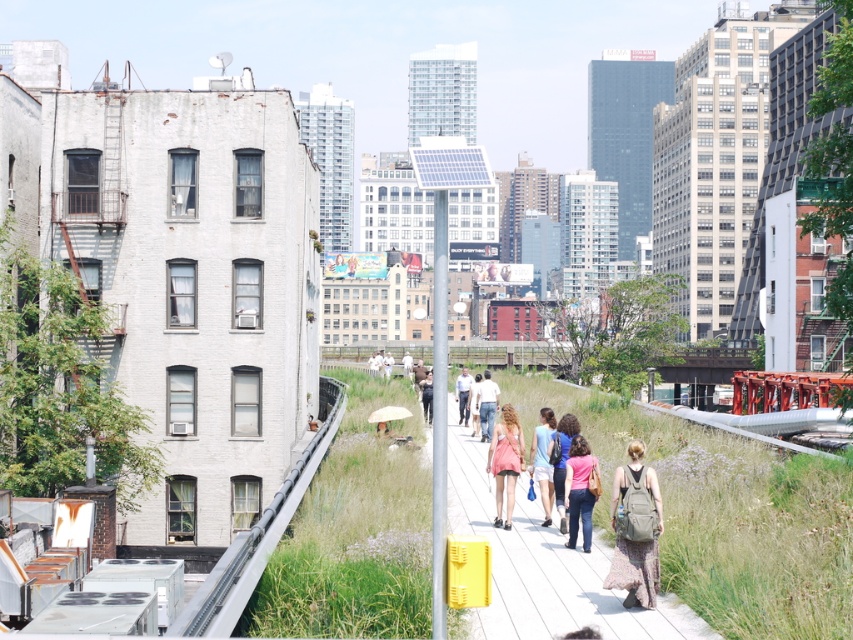
What do you see at coordinates (258, 536) in the screenshot? I see `metallic gray train track at left` at bounding box center [258, 536].

Does metallic gray train track at left appear on the right side of matte blue shirt at center?

Incorrect, metallic gray train track at left is not on the right side of matte blue shirt at center.

Locate an element on the screen. The height and width of the screenshot is (640, 853). metallic gray train track at left is located at coordinates (258, 536).

Who is positioned more to the right, matte blue shirt at center or light blue shirt at center?

Positioned to the right is matte blue shirt at center.

Does matte blue shirt at center have a lesser height compared to light blue shirt at center?

No, matte blue shirt at center is not shorter than light blue shirt at center.

Describe the element at coordinates (561, 460) in the screenshot. I see `matte blue shirt at center` at that location.

Identify the location of matte blue shirt at center. The height and width of the screenshot is (640, 853). (561, 460).

Based on the photo, is pink fabric dress at center closer to camera compared to light brown leather jacket at center?

Yes, it is in front of light brown leather jacket at center.

Can you confirm if pink fabric dress at center is positioned above light brown leather jacket at center?

Correct, pink fabric dress at center is located above light brown leather jacket at center.

Does point (520, 456) come behind point (422, 397)?

No, (520, 456) is in front of (422, 397).

At what (x,y) coordinates should I click in order to perform the action: click on pink fabric dress at center. Please return your answer as a coordinate pair (x, y). The height and width of the screenshot is (640, 853). Looking at the image, I should click on (505, 460).